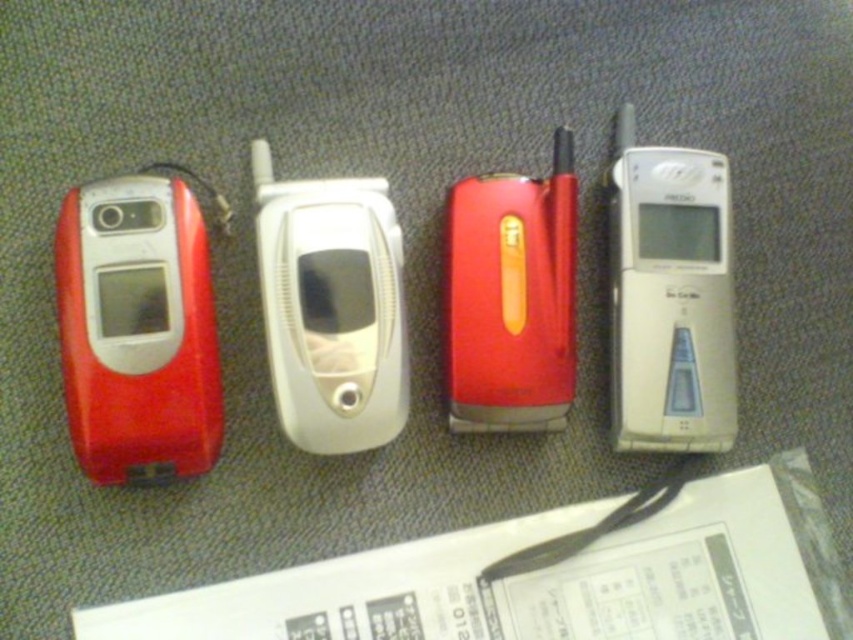
You are a delivery person who needs to place a new phone between the matte red phone at left and the silver metallic phone at right. The new phone is 10 inches long. Can you fit it in the space between them without overlapping?

The distance between the matte red phone at left and the silver metallic phone at right is 22.13 inches. Since the new phone is only 10 inches long, there is enough space to place it between them without overlapping.

Based on the photo, you are trying to choose between the matte red phone at left and the red matte flip phone at center based on size. Which one is larger?

The matte red phone at left is bigger than the red matte flip phone at center.

You are a delivery robot with a 12 inch wide arm. You need to place a package between the silver metallic phone at right and the white glossy flip phone at center. Can your arm fit through the space between them?

The distance between the silver metallic phone at right and the white glossy flip phone at center is 13.70 inches. Since your arm is 12 inches wide, it can fit through the space between them as 12 inches is less than 13.70 inches.